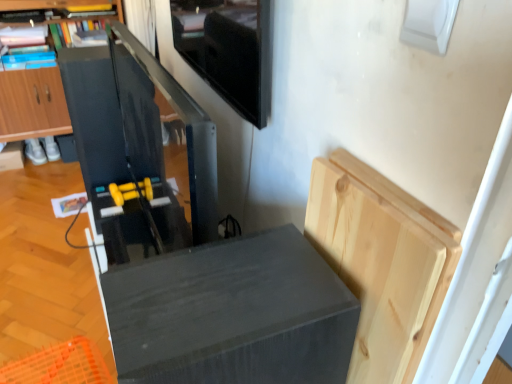
Question: Based on their sizes in the image, would you say matte black speaker at lower center is bigger or smaller than matte black cabinet at left, arranged as the second cabinetry when viewed from the right?

Choices:
 (A) small
 (B) big

Answer: (A)

Question: From the image's perspective, is matte black speaker at lower center located above or below matte black cabinet at left, which is the 1th cabinetry in back-to-front order?

Choices:
 (A) below
 (B) above

Answer: (A)

Question: Which object is positioned farthest from the matte black cabinet at left, which is the 1th cabinetry in back-to-front order?

Choices:
 (A) natural wood cutting board at upper right, the first cabinetry from the right
 (B) matte black speaker at lower center

Answer: (A)

Question: Which object is the closest to the matte black speaker at lower center?

Choices:
 (A) natural wood cutting board at upper right, positioned as the second cabinetry in back-to-front order
 (B) matte black cabinet at left, the second cabinetry ordered from the bottom

Answer: (A)